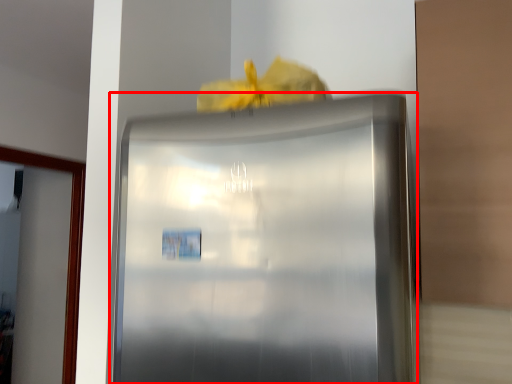
Question: From the image's perspective, considering the relative positions of refrigerator (annotated by the red box) and glass door in the image provided, where is refrigerator (annotated by the red box) located with respect to the staircase?

Choices:
 (A) below
 (B) above

Answer: (B)